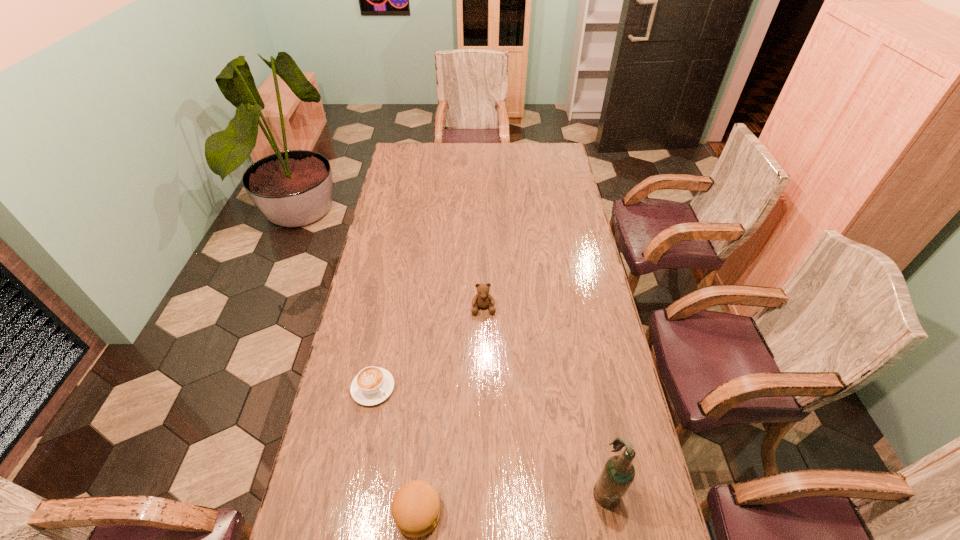
This screenshot has width=960, height=540. Find the location of `hamburger`. hamburger is located at coordinates (416, 508).

At what (x,y) coordinates should I click in order to perform the action: click on the second shortest object. Please return your answer as a coordinate pair (x, y). Looking at the image, I should click on (416, 508).

Find the location of a particular element. The width and height of the screenshot is (960, 540). beer bottle is located at coordinates (618, 473).

At what (x,y) coordinates should I click in order to perform the action: click on the tallest object. Please return your answer as a coordinate pair (x, y). The height and width of the screenshot is (540, 960). Looking at the image, I should click on (618, 473).

What are the coordinates of `the shortest object` in the screenshot? It's located at (372, 385).

This screenshot has width=960, height=540. I want to click on the third nearest object, so click(x=372, y=385).

Image resolution: width=960 pixels, height=540 pixels. I want to click on teddy bear, so click(482, 299).

Find the location of a particular element. the third shortest object is located at coordinates (482, 299).

Find the location of `free space located 0.290m on the right of the hamburger`. free space located 0.290m on the right of the hamburger is located at coordinates (554, 512).

Find the location of a particular element. Image resolution: width=960 pixels, height=540 pixels. blank space located 0.090m on the back of the tallest object is located at coordinates (596, 438).